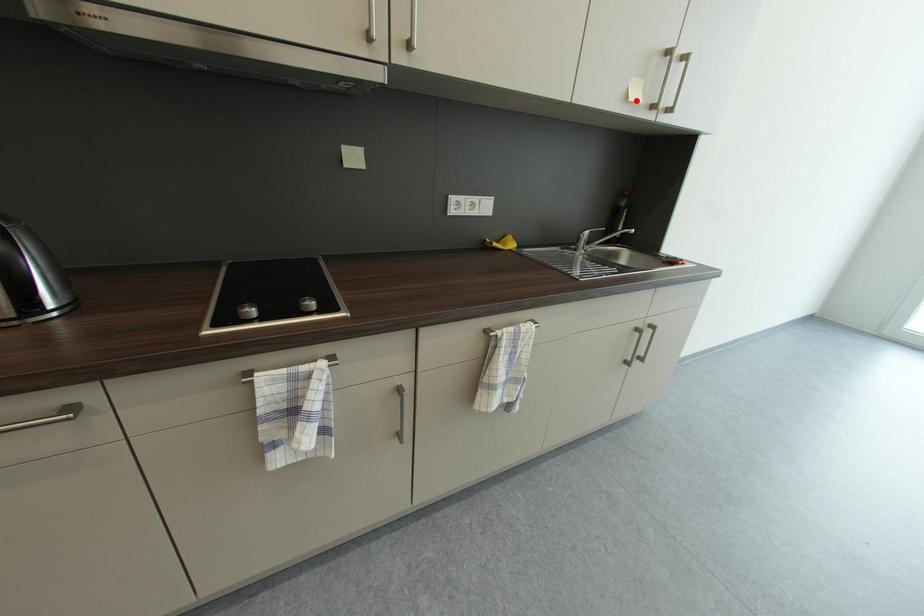
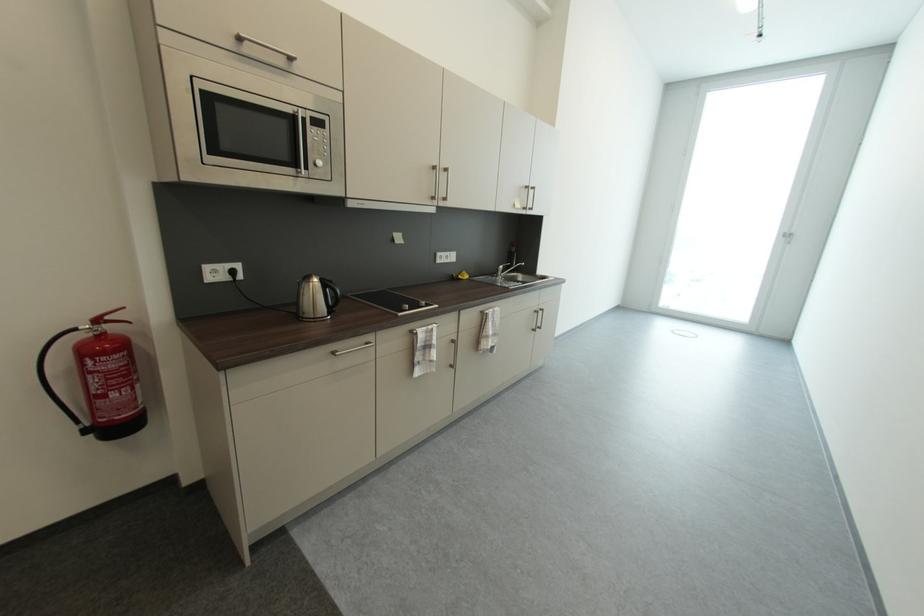
In the second image, find the point that corresponds to the highlighted location in the first image.

(523, 209)